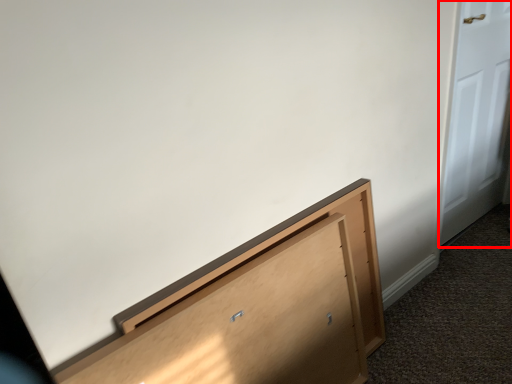
Question: From the image's perspective, considering the relative positions of door (annotated by the red box) and furniture in the image provided, where is door (annotated by the red box) located with respect to the staircase?

Choices:
 (A) below
 (B) above

Answer: (B)